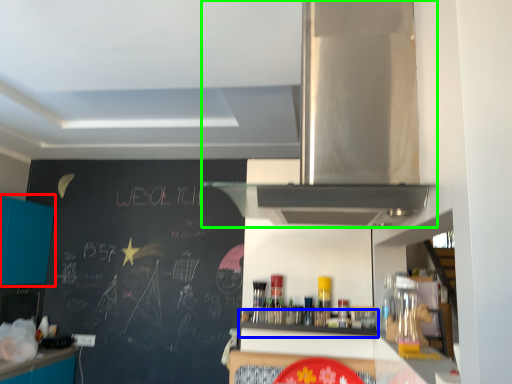
Question: Which object is positioned closest to cabinetry (highlighted by a red box)? Select from shelf (highlighted by a blue box) and home appliance (highlighted by a green box).

Choices:
 (A) shelf
 (B) home appliance

Answer: (A)